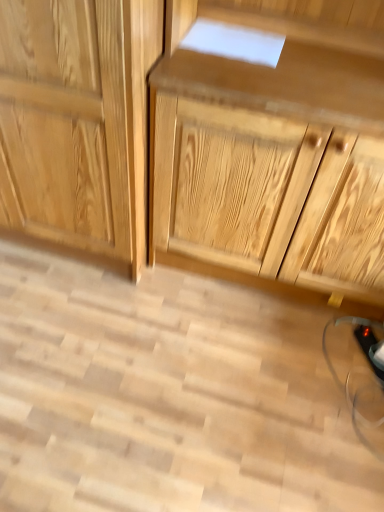
Locate an element on the screen. The image size is (384, 512). natural wood cabinet at center is located at coordinates (77, 121).

This screenshot has height=512, width=384. Describe the element at coordinates (77, 121) in the screenshot. I see `natural wood cabinet at center` at that location.

Image resolution: width=384 pixels, height=512 pixels. What are the coordinates of `natural wood drawer at center` in the screenshot? It's located at (269, 196).

What is the approximate height of natural wood drawer at center?

1.08 meters.

Describe the element at coordinates (269, 196) in the screenshot. I see `natural wood drawer at center` at that location.

At what (x,y) coordinates should I click in order to perform the action: click on natural wood cabinet at center. Please return your answer as a coordinate pair (x, y). The height and width of the screenshot is (512, 384). Looking at the image, I should click on (77, 121).

Considering the positions of objects natural wood drawer at center and natural wood cabinet at center in the image provided, who is more to the left, natural wood drawer at center or natural wood cabinet at center?

natural wood cabinet at center.

Is the position of natural wood drawer at center more distant than that of natural wood cabinet at center?

No.

Does point (382, 264) lie in front of point (82, 183)?

No, (382, 264) is further to viewer.

From the image's perspective, is natural wood drawer at center above or below natural wood cabinet at center?

From the image's perspective, natural wood drawer at center appears below natural wood cabinet at center.

From a real-world perspective, is natural wood drawer at center positioned above or below natural wood cabinet at center?

natural wood drawer at center is above natural wood cabinet at center.

Is natural wood drawer at center wider or thinner than natural wood cabinet at center?

Clearly, natural wood drawer at center has less width compared to natural wood cabinet at center.

Which of these two, natural wood drawer at center or natural wood cabinet at center, stands shorter?

Standing shorter between the two is natural wood cabinet at center.

In terms of size, does natural wood drawer at center appear bigger or smaller than natural wood cabinet at center?

In the image, natural wood drawer at center appears to be smaller than natural wood cabinet at center.

Could natural wood cabinet at center be considered to be inside natural wood drawer at center?

No, natural wood cabinet at center is located outside of natural wood drawer at center.

Is natural wood drawer at center far from natural wood cabinet at center?

No, natural wood drawer at center is in close proximity to natural wood cabinet at center.

Is natural wood drawer at center facing away from natural wood cabinet at center?

No.

In the image, there is a natural wood cabinet at center. At what (x,y) coordinates should I click in order to perform the action: click on drawer below it (from the image's perspective). Please return your answer as a coordinate pair (x, y). This screenshot has height=512, width=384. Looking at the image, I should click on (269, 196).

Considering the positions of objects natural wood cabinet at center and natural wood drawer at center in the image provided, who is more to the left, natural wood cabinet at center or natural wood drawer at center?

natural wood cabinet at center.

Looking at this image, is natural wood cabinet at center in front of or behind natural wood drawer at center in the image?

In the image, natural wood cabinet at center appears behind natural wood drawer at center.

Between point (31, 65) and point (352, 166), which one is positioned behind?

Positioned behind is point (352, 166).

From the image's perspective, is natural wood cabinet at center located above or below natural wood drawer at center?

From the image's perspective, natural wood cabinet at center appears above natural wood drawer at center.

From a real-world perspective, which object rests below the other?

In real-world perspective, natural wood cabinet at center is lower.

Between natural wood cabinet at center and natural wood drawer at center, which one has larger width?

With larger width is natural wood cabinet at center.

Is natural wood cabinet at center shorter than natural wood drawer at center?

Indeed, natural wood cabinet at center has a lesser height compared to natural wood drawer at center.

Considering the relative sizes of natural wood cabinet at center and natural wood drawer at center in the image provided, is natural wood cabinet at center bigger than natural wood drawer at center?

Yes, natural wood cabinet at center is bigger than natural wood drawer at center.

Is natural wood cabinet at center inside the boundaries of natural wood drawer at center, or outside?

natural wood cabinet at center is spatially situated outside natural wood drawer at center.

Is natural wood cabinet at center next to natural wood drawer at center?

No, natural wood cabinet at center is not making contact with natural wood drawer at center.

Could you tell me if natural wood cabinet at center is facing natural wood drawer at center?

No, natural wood cabinet at center is not oriented towards natural wood drawer at center.

There is a natural wood cabinet at center. Where is `drawer above it (from a real-world perspective)`? drawer above it (from a real-world perspective) is located at coordinates (269, 196).

Where is `cabinetry behind the natural wood drawer at center`? The width and height of the screenshot is (384, 512). cabinetry behind the natural wood drawer at center is located at coordinates (77, 121).

Where is `cabinetry that is above the natural wood drawer at center (from the image's perspective)`? The width and height of the screenshot is (384, 512). cabinetry that is above the natural wood drawer at center (from the image's perspective) is located at coordinates (77, 121).